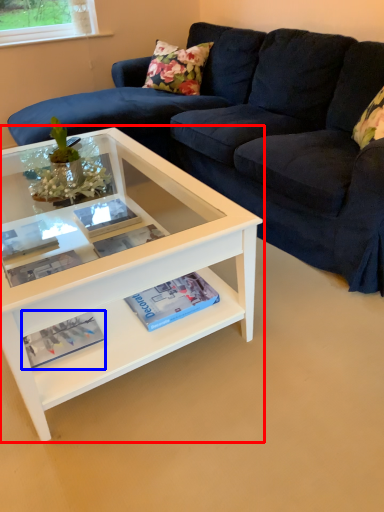
Question: Which of the following is the closest to the observer, coffee table (highlighted by a red box) or magazine (highlighted by a blue box)?

Choices:
 (A) coffee table
 (B) magazine

Answer: (A)